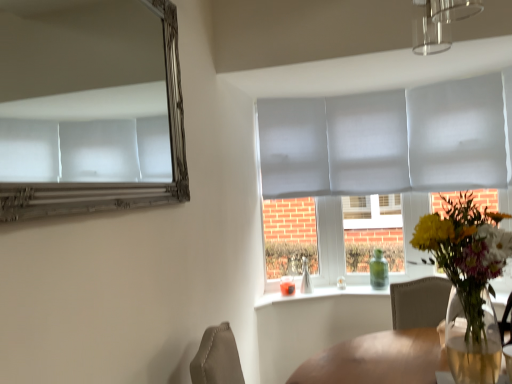
Find the location of a particular element. The image size is (512, 384). free spot to the right of translucent glass vase at window is located at coordinates (324, 285).